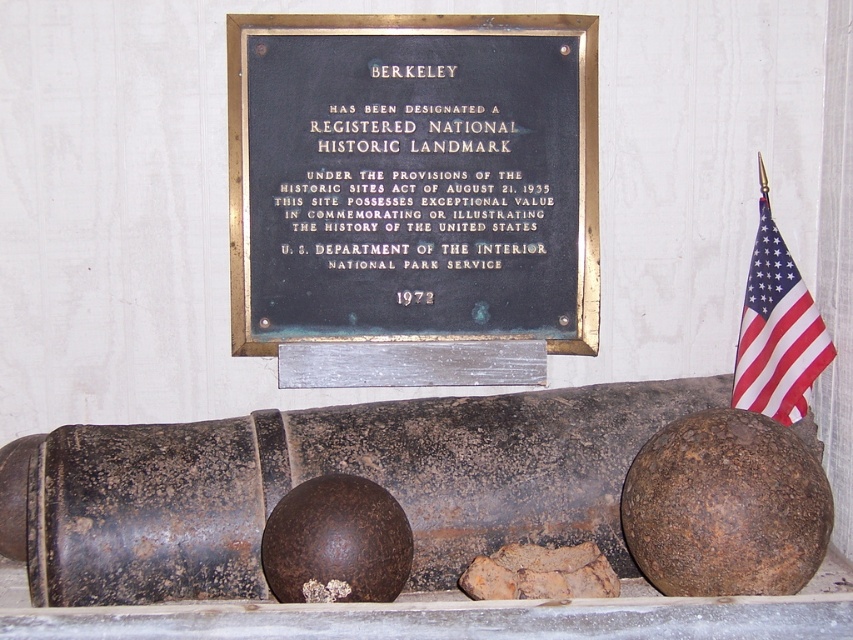
Is black metal plaque at upper center taller than red fabric flag at right?

Indeed, black metal plaque at upper center has a greater height compared to red fabric flag at right.

Is black metal plaque at upper center above red fabric flag at right?

Yes.

Does point (379, 294) lie behind point (769, 308)?

Yes, point (379, 294) is farther from viewer.

Identify the location of black metal plaque at upper center. The height and width of the screenshot is (640, 853). (412, 179).

Is rusty metal cannonball at center positioned before red fabric flag at right?

Yes, it is in front of red fabric flag at right.

Does rusty metal cannonball at center appear on the left side of red fabric flag at right?

Correct, you'll find rusty metal cannonball at center to the left of red fabric flag at right.

The height and width of the screenshot is (640, 853). What do you see at coordinates (726, 506) in the screenshot?
I see `rusty metal cannonball at center` at bounding box center [726, 506].

This screenshot has width=853, height=640. I want to click on rusty metal cannonball at center, so click(726, 506).

Who is positioned more to the left, rusty metal cannon at center or rusty metal cannonball at center?

rusty metal cannon at center is more to the left.

Image resolution: width=853 pixels, height=640 pixels. Describe the element at coordinates (335, 472) in the screenshot. I see `rusty metal cannon at center` at that location.

Identify the location of rusty metal cannon at center. (335, 472).

This screenshot has height=640, width=853. I want to click on rusty metal cannon at center, so click(x=335, y=472).